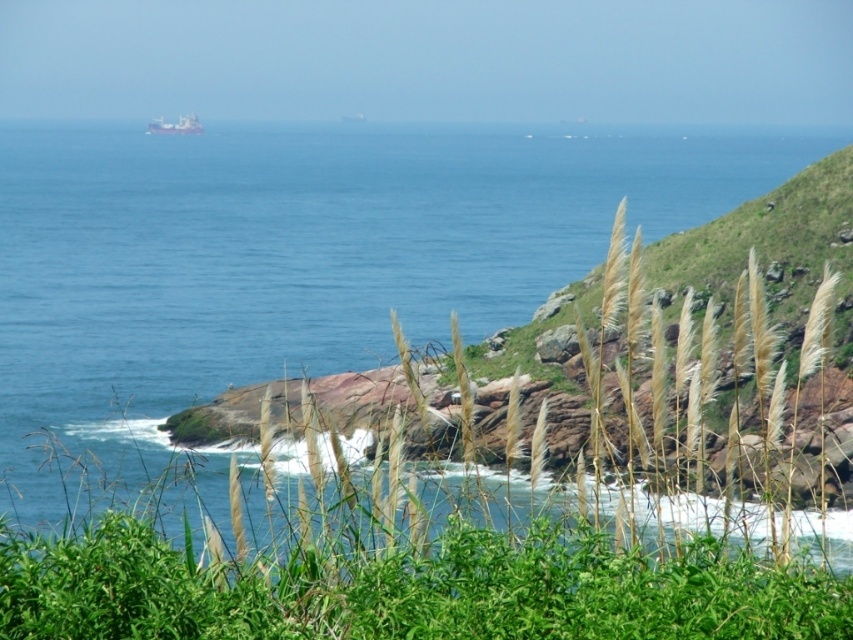
Which is below, blue water at center or metallic gray ship at upper center?

blue water at center is below.

Describe the element at coordinates (297, 259) in the screenshot. This screenshot has width=853, height=640. I see `blue water at center` at that location.

Is point (312, 193) closer to viewer compared to point (184, 131)?

Yes, point (312, 193) is in front of point (184, 131).

Locate an element on the screen. This screenshot has width=853, height=640. blue water at center is located at coordinates (297, 259).